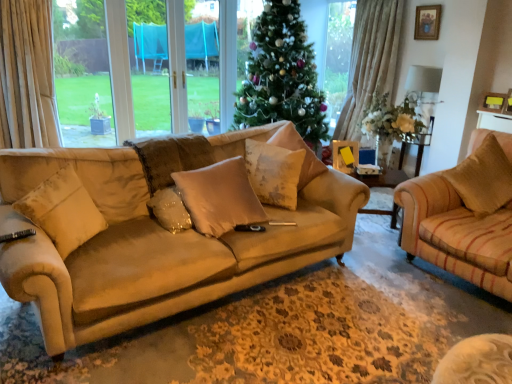
The height and width of the screenshot is (384, 512). What do you see at coordinates (345, 155) in the screenshot?
I see `matte yellow picture frame at center, which appears as the 1th picture frame when viewed from the left` at bounding box center [345, 155].

What do you see at coordinates (154, 246) in the screenshot?
I see `suede beige couch at center` at bounding box center [154, 246].

At what (x,y) coordinates should I click in order to perform the action: click on matte yellow picture frame at center, the 2th picture frame viewed from the top. Please return your answer as a coordinate pair (x, y). The height and width of the screenshot is (384, 512). Looking at the image, I should click on (345, 155).

Considering the relative sizes of beige suede pillow at left, which appears as the 5th pillow when viewed from the right, and wooden side table at center in the image provided, is beige suede pillow at left, which appears as the 5th pillow when viewed from the right, shorter than wooden side table at center?

No.

Is beige suede pillow at left, which appears as the 5th pillow when viewed from the right, to the right of wooden side table at center from the viewer's perspective?

Incorrect, beige suede pillow at left, which appears as the 5th pillow when viewed from the right, is not on the right side of wooden side table at center.

Based on the photo, how different are the orientations of beige suede pillow at left, the first pillow from the left, and wooden side table at center in degrees?

The facing directions of beige suede pillow at left, the first pillow from the left, and wooden side table at center are 83.4 degrees apart.

Starting from the wooden side table at center, which pillow is the 5th one in front? Please provide its 2D coordinates.

[(63, 211)]

This screenshot has width=512, height=384. What are the coordinates of `christmas tree above the suede beige couch at center (from a real-world perspective)` in the screenshot? It's located at (282, 75).

Considering the relative sizes of suede beige couch at center and green matte christmas tree at center in the image provided, is suede beige couch at center bigger than green matte christmas tree at center?

Incorrect, suede beige couch at center is not larger than green matte christmas tree at center.

Are suede beige couch at center and green matte christmas tree at center beside each other?

suede beige couch at center and green matte christmas tree at center are clearly separated.

Which is less distant, [121,271] or [287,117]?

The point [121,271] is in front.

Is matte yellow picture frame at center, the 2th picture frame positioned from the right, wider than wooden picture frame at upper right, arranged as the second picture frame when viewed from the left?

Yes.

Could you tell me if matte yellow picture frame at center, the 2th picture frame positioned from the right, is turned towards wooden picture frame at upper right, the 1th picture frame positioned from the top?

No, matte yellow picture frame at center, the 2th picture frame positioned from the right, is not facing towards wooden picture frame at upper right, the 1th picture frame positioned from the top.

Where is `picture frame below the wooden picture frame at upper right, arranged as the second picture frame when viewed from the left (from a real-world perspective)`? This screenshot has height=384, width=512. picture frame below the wooden picture frame at upper right, arranged as the second picture frame when viewed from the left (from a real-world perspective) is located at coordinates (345, 155).

Which of these two, brown textured pillow at right, arranged as the 1th pillow when viewed from the right, or wooden picture frame at upper right, the 1th picture frame in the right-to-left sequence, is smaller?

With smaller size is wooden picture frame at upper right, the 1th picture frame in the right-to-left sequence.

Between brown textured pillow at right, the 5th pillow positioned from the left, and wooden picture frame at upper right, which is the second picture frame in front-to-back order, which one has larger width?

brown textured pillow at right, the 5th pillow positioned from the left, is wider.

What's the angular difference between brown textured pillow at right, arranged as the 1th pillow when viewed from the right, and wooden picture frame at upper right, the 1th picture frame in the right-to-left sequence,'s facing directions?

They differ by 45.9 degrees in their facing directions.

Between point (485, 203) and point (426, 32), which one is positioned in front?

The point (485, 203) is closer.

From the picture: Considering the sizes of objects wooden picture frame at upper right, which appears as the 2th picture frame when ordered from the bottom, and beige suede pillow at left, the first pillow from the left, in the image provided, who is taller, wooden picture frame at upper right, which appears as the 2th picture frame when ordered from the bottom, or beige suede pillow at left, the first pillow from the left,?

With more height is beige suede pillow at left, the first pillow from the left.

From a real-world perspective, between wooden picture frame at upper right, which appears as the 2th picture frame when ordered from the bottom, and beige suede pillow at left, which appears as the 5th pillow when viewed from the right, who is vertically lower?

beige suede pillow at left, which appears as the 5th pillow when viewed from the right.

Does wooden picture frame at upper right, the 1th picture frame in the right-to-left sequence, come in front of beige suede pillow at left, which appears as the 5th pillow when viewed from the right?

No, the depth of wooden picture frame at upper right, the 1th picture frame in the right-to-left sequence, is greater than that of beige suede pillow at left, which appears as the 5th pillow when viewed from the right.

Is wooden picture frame at upper right, which appears as the 2th picture frame when ordered from the bottom, to the left or to the right of beige suede pillow at left, which appears as the 5th pillow when viewed from the right, in the image?

Based on their positions, wooden picture frame at upper right, which appears as the 2th picture frame when ordered from the bottom, is located to the right of beige suede pillow at left, which appears as the 5th pillow when viewed from the right.

Locate an element on the screen. The image size is (512, 384). pillow that is the 4th one above the wooden side table at center (from a real-world perspective) is located at coordinates (483, 178).

Would you say wooden side table at center is outside brown textured pillow at right, the 5th pillow positioned from the left?

Indeed, wooden side table at center is completely outside brown textured pillow at right, the 5th pillow positioned from the left.

Is wooden side table at center facing away from brown textured pillow at right, the 5th pillow positioned from the left?

wooden side table at center does not have its back to brown textured pillow at right, the 5th pillow positioned from the left.

Is matte yellow picture frame at center, marked as the 1th picture frame in a front-to-back arrangement, situated inside satin beige pillow at center, which is the second pillow from left to right, or outside?

matte yellow picture frame at center, marked as the 1th picture frame in a front-to-back arrangement, lies outside satin beige pillow at center, which is the second pillow from left to right.

From a real-world perspective, between matte yellow picture frame at center, arranged as the 2th picture frame when viewed from the back, and satin beige pillow at center, which is the second pillow from left to right, who is vertically lower?

satin beige pillow at center, which is the second pillow from left to right, from a real-world perspective.

Identify the location of the 5th pillow in front of the wooden side table at center, counting from the anchor's position. click(63, 211).

Find the location of `christmas tree that is above the suede beige couch at center (from the image's perspective)`. christmas tree that is above the suede beige couch at center (from the image's perspective) is located at coordinates (282, 75).

Based on their spatial positions, is beige suede pillow at left, which appears as the 5th pillow when viewed from the right, or brown textured pillow at right, the 5th pillow positioned from the left, further from green matte christmas tree at center?

Among the two, beige suede pillow at left, which appears as the 5th pillow when viewed from the right, is located further to green matte christmas tree at center.

Which object lies further to the anchor point satin beige pillow at center, which is the second pillow from left to right, wooden side table at center or beige fabric pillow at center, placed as the 2th pillow when sorted from right to left?

Among the two, wooden side table at center is located further to satin beige pillow at center, which is the second pillow from left to right.

From the image, which object appears to be nearer to brown textured pillow at right, the 5th pillow positioned from the left, fluffy beige pillow at center, arranged as the 3th pillow when viewed from the right, or satin beige pillow at center, which is the second pillow from left to right?

fluffy beige pillow at center, arranged as the 3th pillow when viewed from the right, lies closer to brown textured pillow at right, the 5th pillow positioned from the left, than the other object.

Estimate the real-world distances between objects in this image. Which object is further from brown textured pillow at right, arranged as the 1th pillow when viewed from the right, beige fabric pillow at center, the fourth pillow in the left-to-right sequence, or green matte christmas tree at center?

The object further to brown textured pillow at right, arranged as the 1th pillow when viewed from the right, is green matte christmas tree at center.

Which object lies nearer to the anchor point satin beige pillow at center, which is the second pillow from left to right, matte yellow picture frame at center, marked as the 1th picture frame in a front-to-back arrangement, or wooden side table at center?

matte yellow picture frame at center, marked as the 1th picture frame in a front-to-back arrangement, lies closer to satin beige pillow at center, which is the second pillow from left to right, than the other object.

Estimate the real-world distances between objects in this image. Which object is further from suede beige couch at center, satin beige pillow at center, marked as the 4th pillow in a right-to-left arrangement, or green matte christmas tree at center?

green matte christmas tree at center.

When comparing their distances from wooden picture frame at upper right, arranged as the second picture frame when viewed from the left, does brown textured pillow at right, the 5th pillow positioned from the left, or wooden side table at center seem further?

brown textured pillow at right, the 5th pillow positioned from the left, is further to wooden picture frame at upper right, arranged as the second picture frame when viewed from the left.

Looking at the image, which one is located closer to green matte christmas tree at center, fluffy beige pillow at center, which is the third pillow from left to right, or wooden side table at center?

wooden side table at center is closer to green matte christmas tree at center.

Locate an element on the screen. This screenshot has width=512, height=384. side table located between suede beige couch at center and matte yellow picture frame at center, arranged as the 2th picture frame when viewed from the back, in the depth direction is located at coordinates (383, 178).

This screenshot has height=384, width=512. What are the coordinates of `pillow between fluffy beige pillow at center, which is the third pillow from left to right, and brown textured pillow at right, arranged as the 1th pillow when viewed from the right, in the horizontal direction` in the screenshot? It's located at (298, 149).

Locate an element on the screen. Image resolution: width=512 pixels, height=384 pixels. picture frame located between satin beige pillow at center, which is the second pillow from left to right, and brown textured pillow at right, arranged as the 1th pillow when viewed from the right, in the left-right direction is located at coordinates pos(345,155).

Locate an element on the screen. Image resolution: width=512 pixels, height=384 pixels. side table positioned between suede beige couch at center and wooden picture frame at upper right, which is the second picture frame in front-to-back order, from near to far is located at coordinates (383, 178).